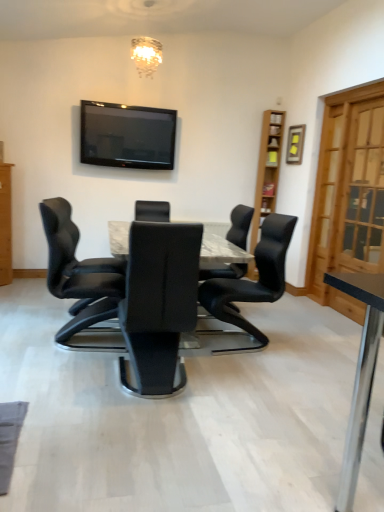
Question: Is wooden bookshelf at upper right oriented away from black leather chair at center, which is the second chair in left-to-right order?

Choices:
 (A) no
 (B) yes

Answer: (A)

Question: From a real-world perspective, is wooden bookshelf at upper right beneath black leather chair at center, acting as the 2th chair starting from the right?

Choices:
 (A) yes
 (B) no

Answer: (B)

Question: Is wooden bookshelf at upper right at the right side of black leather chair at center, which is the second chair in left-to-right order?

Choices:
 (A) yes
 (B) no

Answer: (A)

Question: Does wooden bookshelf at upper right have a greater width compared to black leather chair at center, which is the second chair in left-to-right order?

Choices:
 (A) no
 (B) yes

Answer: (A)

Question: From a real-world perspective, is wooden bookshelf at upper right on black leather chair at center, acting as the 2th chair starting from the right?

Choices:
 (A) yes
 (B) no

Answer: (A)

Question: Considering the relative sizes of wooden bookshelf at upper right and black leather chair at center, which is the second chair in left-to-right order, in the image provided, is wooden bookshelf at upper right shorter than black leather chair at center, which is the second chair in left-to-right order,?

Choices:
 (A) yes
 (B) no

Answer: (B)

Question: Can you confirm if black leather chair at left, arranged as the 1th chair when viewed from the left, is positioned to the right of light brown wooden cabinet at left?

Choices:
 (A) no
 (B) yes

Answer: (B)

Question: Would you say light brown wooden cabinet at left is part of black leather chair at left, arranged as the 1th chair when viewed from the left,'s contents?

Choices:
 (A) yes
 (B) no

Answer: (B)

Question: Is the depth of black leather chair at left, marked as the third chair in a right-to-left arrangement, less than that of light brown wooden cabinet at left?

Choices:
 (A) yes
 (B) no

Answer: (A)

Question: From the image's perspective, is black leather chair at left, marked as the third chair in a right-to-left arrangement, located above light brown wooden cabinet at left?

Choices:
 (A) no
 (B) yes

Answer: (A)

Question: From a real-world perspective, is black leather chair at left, arranged as the 1th chair when viewed from the left, under light brown wooden cabinet at left?

Choices:
 (A) yes
 (B) no

Answer: (A)

Question: Does black leather chair at left, arranged as the 1th chair when viewed from the left, lie behind light brown wooden cabinet at left?

Choices:
 (A) yes
 (B) no

Answer: (B)

Question: Can you confirm if light brown wooden cabinet at left is smaller than marble table at center?

Choices:
 (A) yes
 (B) no

Answer: (A)